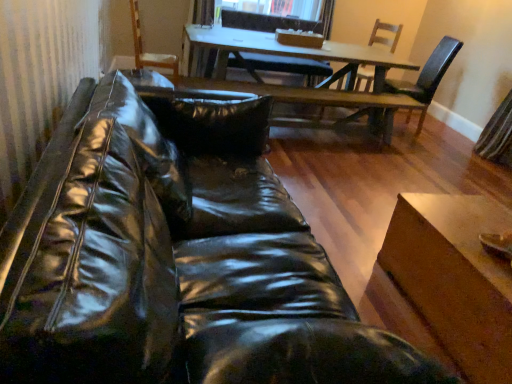
The height and width of the screenshot is (384, 512). What do you see at coordinates (149, 53) in the screenshot? I see `wooden armchair at upper center` at bounding box center [149, 53].

Locate an element on the screen. wooden armchair at upper center is located at coordinates click(149, 53).

What is the approximate width of wooden table at lower right, which appears as the 1th table when viewed from the front?

It is 23.72 inches.

This screenshot has height=384, width=512. Describe the element at coordinates (386, 30) in the screenshot. I see `wooden chair at upper right, the 2th chair when ordered from left to right` at that location.

In order to click on glossy leather couch at lower left in this screenshot , I will do `click(176, 258)`.

Is wooden chair at upper center, placed as the third chair when sorted from right to left, completely or partially outside of glossy leather couch at lower left?

That's correct, wooden chair at upper center, placed as the third chair when sorted from right to left, is outside of glossy leather couch at lower left.

Is wooden chair at upper center, the 1th chair when ordered from left to right, bigger or smaller than glossy leather couch at lower left?

wooden chair at upper center, the 1th chair when ordered from left to right, is smaller than glossy leather couch at lower left.

Is wooden chair at upper center, placed as the third chair when sorted from right to left, taller than glossy leather couch at lower left?

Indeed, wooden chair at upper center, placed as the third chair when sorted from right to left, has a greater height compared to glossy leather couch at lower left.

From the image's perspective, starting from the glossy leather couch at lower left, which chair is the 2nd one above? Please provide its 2D coordinates.

[(281, 66)]

Could you tell me if matte black chair at upper right, the 3th chair from the left, is turned towards glossy leather couch at lower left?

No, matte black chair at upper right, the 3th chair from the left, is not aimed at glossy leather couch at lower left.

Is matte black chair at upper right, the first chair positioned from the right, not inside glossy leather couch at lower left?

matte black chair at upper right, the first chair positioned from the right, lies outside glossy leather couch at lower left's area.

What's the angular difference between matte black chair at upper right, the 3th chair from the left, and glossy leather couch at lower left's facing directions?

→ The facing directions of matte black chair at upper right, the 3th chair from the left, and glossy leather couch at lower left are 176 degrees apart.

Considering the sizes of objects matte black chair at upper right, the 3th chair from the left, and glossy leather couch at lower left in the image provided, who is taller, matte black chair at upper right, the 3th chair from the left, or glossy leather couch at lower left?

matte black chair at upper right, the 3th chair from the left.

What are the coordinates of `armchair that is above the wooden table at lower right, which appears as the 1th table when viewed from the front (from a real-world perspective)` in the screenshot? It's located at (149, 53).

Consider the image. What's the angular difference between wooden armchair at upper center and wooden table at lower right, which is the second table in back-to-front order,'s facing directions?

The facing directions of wooden armchair at upper center and wooden table at lower right, which is the second table in back-to-front order, are 5.79 degrees apart.

Is wooden armchair at upper center oriented towards wooden table at lower right, the first table ordered from the bottom?

No, wooden armchair at upper center is not aimed at wooden table at lower right, the first table ordered from the bottom.

Considering the sizes of objects wooden armchair at upper center and wooden table at lower right, marked as the 2th table in a top-to-bottom arrangement, in the image provided, who is wider, wooden armchair at upper center or wooden table at lower right, marked as the 2th table in a top-to-bottom arrangement,?

wooden table at lower right, marked as the 2th table in a top-to-bottom arrangement, is wider.

The image size is (512, 384). Find the location of `table to the right of wooden table at center, which ranks as the 2th table in front-to-back order`. table to the right of wooden table at center, which ranks as the 2th table in front-to-back order is located at coordinates (454, 278).

Considering the positions of objects wooden table at lower right, the first table ordered from the bottom, and wooden table at center, the second table ordered from the bottom, in the image provided, who is behind, wooden table at lower right, the first table ordered from the bottom, or wooden table at center, the second table ordered from the bottom,?

wooden table at center, the second table ordered from the bottom, is more distant.

From a real-world perspective, is wooden table at lower right, which appears as the 1th table when viewed from the front, positioned under wooden table at center, which ranks as the 2th table in front-to-back order, based on gravity?

Yes, from a real-world perspective, wooden table at lower right, which appears as the 1th table when viewed from the front, is under wooden table at center, which ranks as the 2th table in front-to-back order.

Could you tell me if wooden table at lower right, the first table ordered from the bottom, is turned towards wooden table at center, which ranks as the 2th table in front-to-back order?

No, wooden table at lower right, the first table ordered from the bottom, is not turned towards wooden table at center, which ranks as the 2th table in front-to-back order.

From the image's perspective, which object appears higher, wooden table at lower right, the first table ordered from the bottom, or wooden chair at upper right, arranged as the second chair when viewed from the right?

wooden chair at upper right, arranged as the second chair when viewed from the right, appears higher in the image.

How distant is wooden table at lower right, marked as the 2th table in a top-to-bottom arrangement, from wooden chair at upper right, the 2th chair when ordered from left to right?

wooden table at lower right, marked as the 2th table in a top-to-bottom arrangement, is 14.18 feet away from wooden chair at upper right, the 2th chair when ordered from left to right.

Is wooden table at lower right, marked as the 2th table in a top-to-bottom arrangement, taller or shorter than wooden chair at upper right, arranged as the second chair when viewed from the right?

In the image, wooden table at lower right, marked as the 2th table in a top-to-bottom arrangement, appears to be shorter than wooden chair at upper right, arranged as the second chair when viewed from the right.

Can you confirm if wooden table at lower right, which appears as the 1th table when viewed from the front, is smaller than wooden chair at upper right, arranged as the second chair when viewed from the right?

Yes.

Which is behind, point (251, 67) or point (156, 55)?

Positioned behind is point (251, 67).

You are a GUI agent. You are given a task and a screenshot of the screen. Output one action in this format:
    pyautogui.click(x=<x>, y=<y>)
    Task: Click on the 1st chair positioned above the wooden armchair at upper center (from the image's perspective)
    The height and width of the screenshot is (384, 512).
    Given the screenshot: What is the action you would take?
    pyautogui.click(x=281, y=66)

From the image's perspective, is wooden chair at upper center, the 1th chair when ordered from left to right, positioned above or below wooden armchair at upper center?

From the image's perspective, wooden chair at upper center, the 1th chair when ordered from left to right, appears above wooden armchair at upper center.

From the image's perspective, is wooden armchair at upper center located above wooden chair at upper center, placed as the third chair when sorted from right to left?

No.

Can you confirm if wooden armchair at upper center is smaller than wooden chair at upper center, placed as the third chair when sorted from right to left?

Correct, wooden armchair at upper center occupies less space than wooden chair at upper center, placed as the third chair when sorted from right to left.

Would you say wooden armchair at upper center is a long distance from wooden chair at upper center, placed as the third chair when sorted from right to left?

Yes, wooden armchair at upper center is far from wooden chair at upper center, placed as the third chair when sorted from right to left.

From a real-world perspective, relative to wooden chair at upper center, the 1th chair when ordered from left to right, is wooden armchair at upper center vertically above or below?

From a real-world perspective, wooden armchair at upper center is physically above wooden chair at upper center, the 1th chair when ordered from left to right.

The image size is (512, 384). In order to click on chair that is the 1st object to the right of the glossy leather couch at lower left, starting at the anchor in this screenshot , I will do `click(281, 66)`.

The height and width of the screenshot is (384, 512). I want to click on studio couch below the matte black chair at upper right, the 3th chair from the left (from a real-world perspective), so click(x=176, y=258).

Considering their positions, is wooden table at lower right, which is the second table in back-to-front order, positioned further to wooden armchair at upper center than wooden chair at upper center, the 1th chair when ordered from left to right?

wooden table at lower right, which is the second table in back-to-front order.

Which object lies further to the anchor point wooden chair at upper center, placed as the third chair when sorted from right to left, matte black chair at upper right, the first chair positioned from the right, or wooden armchair at upper center?

matte black chair at upper right, the first chair positioned from the right, is further to wooden chair at upper center, placed as the third chair when sorted from right to left.

Which object lies nearer to the anchor point wooden table at lower right, which is the second table in back-to-front order, matte black chair at upper right, the 3th chair from the left, or wooden table at center, the first table when ordered from top to bottom?

Based on the image, wooden table at center, the first table when ordered from top to bottom, appears to be nearer to wooden table at lower right, which is the second table in back-to-front order.

From the image, which object appears to be farther from wooden chair at upper right, arranged as the second chair when viewed from the right, wooden armchair at upper center or matte black chair at upper right, the 3th chair from the left?

Based on the image, wooden armchair at upper center appears to be further to wooden chair at upper right, arranged as the second chair when viewed from the right.

Looking at the image, which one is located closer to wooden table at center, which ranks as the 2th table in front-to-back order, glossy leather couch at lower left or wooden chair at upper right, arranged as the second chair when viewed from the right?

The object closer to wooden table at center, which ranks as the 2th table in front-to-back order, is wooden chair at upper right, arranged as the second chair when viewed from the right.

From the picture: Looking at the image, which one is located closer to wooden chair at upper center, the 1th chair when ordered from left to right, wooden table at lower right, which is the second table in back-to-front order, or wooden chair at upper right, arranged as the second chair when viewed from the right?

Based on the image, wooden chair at upper right, arranged as the second chair when viewed from the right, appears to be nearer to wooden chair at upper center, the 1th chair when ordered from left to right.

Estimate the real-world distances between objects in this image. Which object is closer to wooden chair at upper right, the 2th chair when ordered from left to right, wooden chair at upper center, placed as the third chair when sorted from right to left, or wooden armchair at upper center?

wooden chair at upper center, placed as the third chair when sorted from right to left, is positioned closer to the anchor wooden chair at upper right, the 2th chair when ordered from left to right.

From the image, which object appears to be nearer to wooden chair at upper center, the 1th chair when ordered from left to right, wooden table at lower right, which appears as the 1th table when viewed from the front, or glossy leather couch at lower left?

glossy leather couch at lower left is positioned closer to the anchor wooden chair at upper center, the 1th chair when ordered from left to right.

Identify the location of chair located between wooden armchair at upper center and wooden chair at upper right, the 2th chair when ordered from left to right, in the left-right direction. This screenshot has height=384, width=512. (281, 66).

This screenshot has height=384, width=512. Find the location of `armchair positioned between glossy leather couch at lower left and matte black chair at upper right, the 3th chair from the left, from near to far`. armchair positioned between glossy leather couch at lower left and matte black chair at upper right, the 3th chair from the left, from near to far is located at coordinates (149, 53).

In order to click on chair between wooden table at center, the second table ordered from the bottom, and matte black chair at upper right, the 3th chair from the left, in the horizontal direction in this screenshot , I will do `click(386, 30)`.

This screenshot has height=384, width=512. Find the location of `table located between wooden table at lower right, which is the second table in back-to-front order, and wooden chair at upper right, the 2th chair when ordered from left to right, in the depth direction`. table located between wooden table at lower right, which is the second table in back-to-front order, and wooden chair at upper right, the 2th chair when ordered from left to right, in the depth direction is located at coordinates (310, 58).